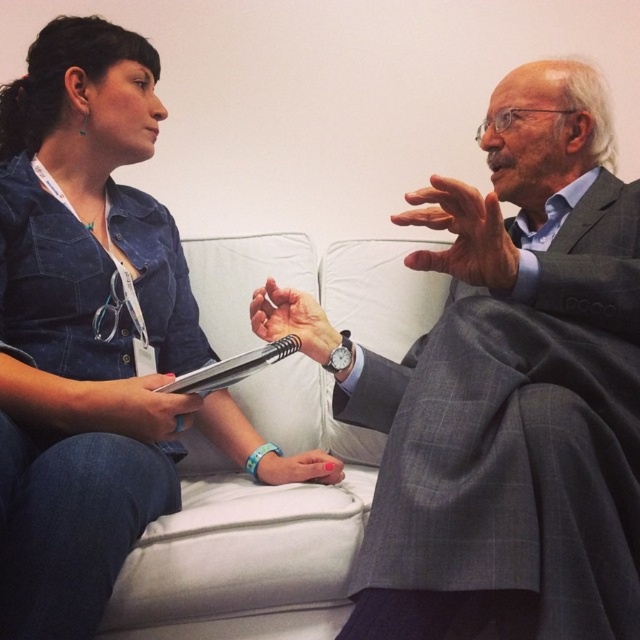
Question: Is gray checkered suit at center positioned before denim jacket at upper left?

Choices:
 (A) no
 (B) yes

Answer: (B)

Question: Which of the following is the farthest from the observer?

Choices:
 (A) gray checkered suit at center
 (B) denim jacket at upper left

Answer: (B)

Question: Does gray checkered suit at center appear under denim jacket at upper left?

Choices:
 (A) yes
 (B) no

Answer: (B)

Question: Is gray checkered suit at center thinner than denim jacket at upper left?

Choices:
 (A) no
 (B) yes

Answer: (A)